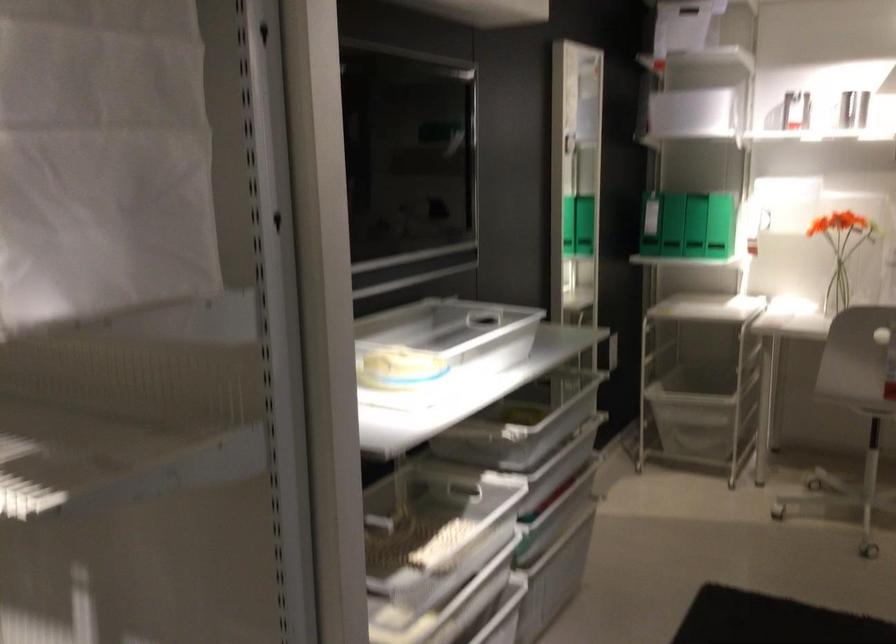
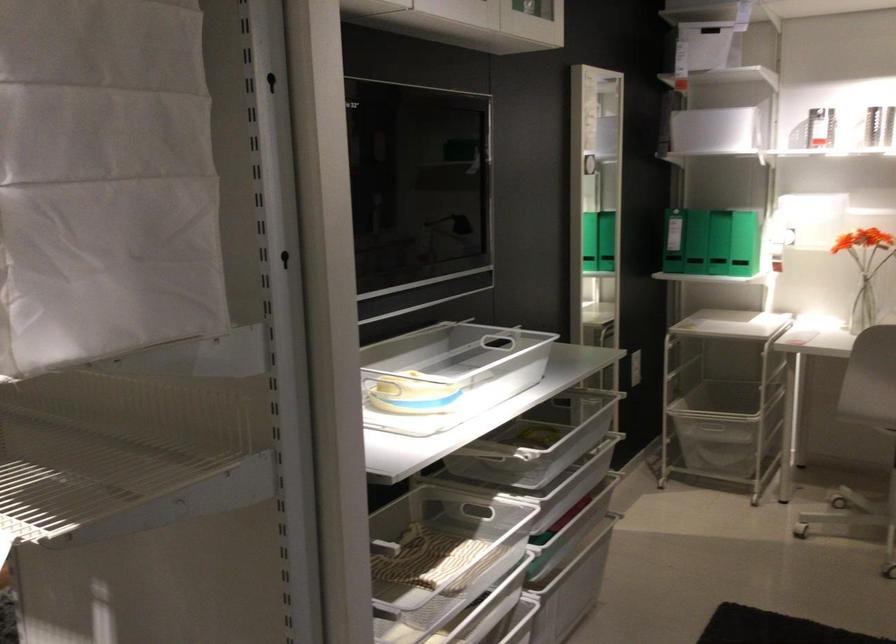
The point at [389,522] is marked in the first image. Where is the corresponding point in the second image?

(393, 545)